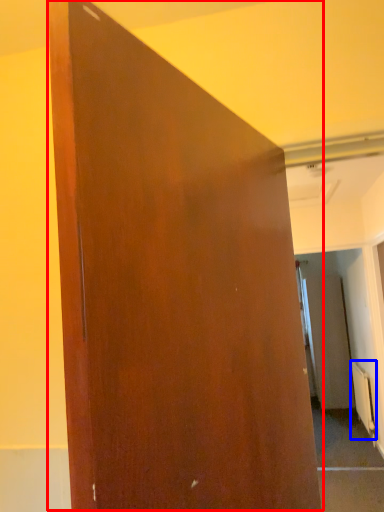
Question: Which object is closer to the camera taking this photo, door (highlighted by a red box) or radiator (highlighted by a blue box)?

Choices:
 (A) door
 (B) radiator

Answer: (A)